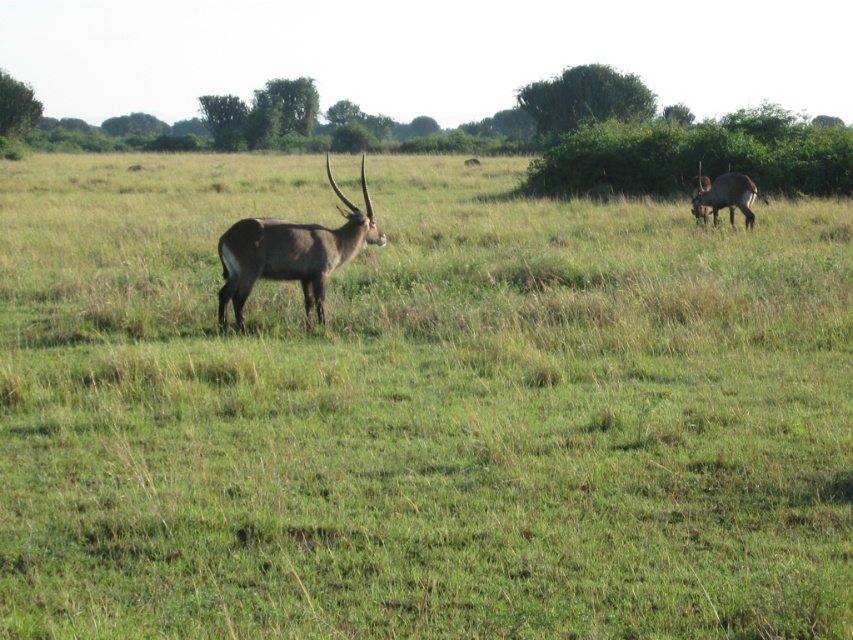
You are a wildlife photographer aiming to capture both brown glossy antelope at center and brown glossy antelope at upper right in a single frame. Based on their positions, which antelope should be positioned to the left in your photo?

The brown glossy antelope at center should be positioned to the left in your photo because it is to the left of the brown glossy antelope at upper right.

Based on the coordinates provided in the description, where is the brown glossy antelope at center located in the image?

The brown glossy antelope at center is located at point coordinates of [291,252].

You are standing in the savanna and see two points marked in the image. Which point is closer to you, point [300,256] or point [763,198]?

Point [300,256] is closer to you because it is in front of point [763,198].